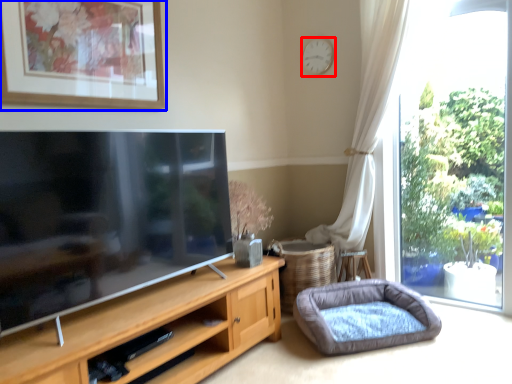
Question: Which of the following is the closest to the observer, clock (highlighted by a red box) or picture frame (highlighted by a blue box)?

Choices:
 (A) clock
 (B) picture frame

Answer: (B)